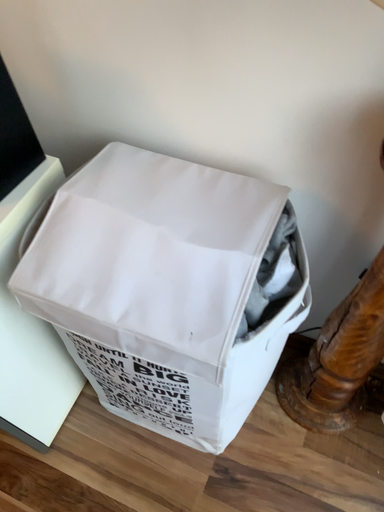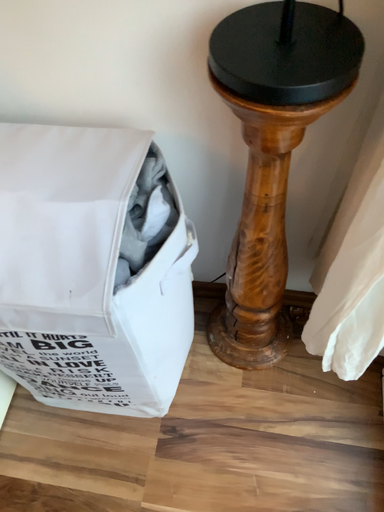
Question: How did the camera likely rotate when shooting the video?

Choices:
 (A) rotated left
 (B) rotated right

Answer: (B)